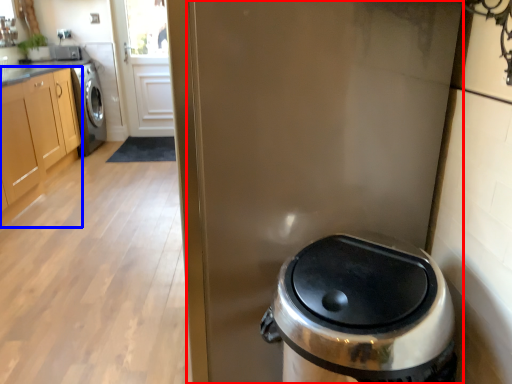
Question: Which of the following is the farthest to the observer, screen door (highlighted by a red box) or cabinetry (highlighted by a blue box)?

Choices:
 (A) screen door
 (B) cabinetry

Answer: (B)